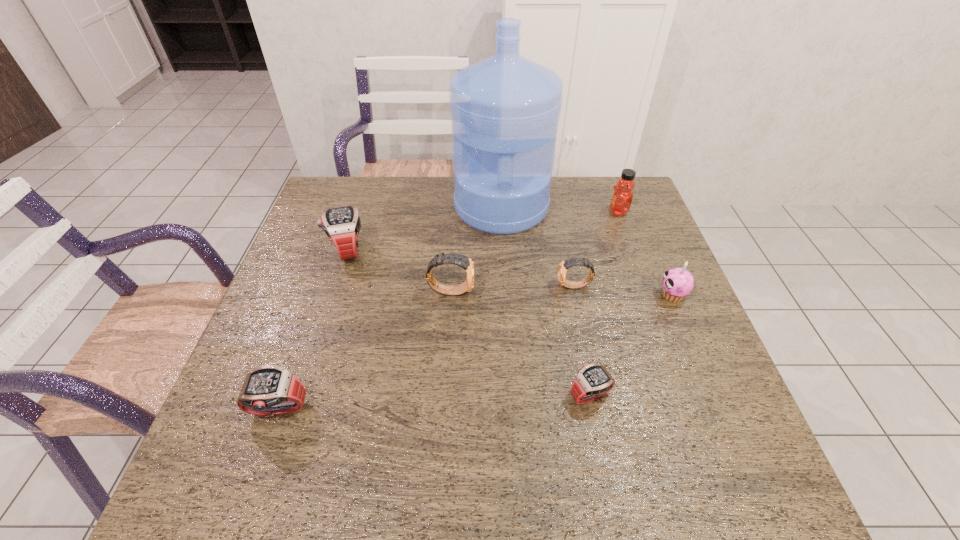
Select which red watch is the closest to the shortest object. Please provide its 2D coordinates. Your answer should be formatted as a tuple, i.e. [(x, y)], where the tuple contains the x and y coordinates of a point satisfying the conditions above.

[(270, 390)]

Choose which red watch is the second nearest neighbor to the honey. Please provide its 2D coordinates. Your answer should be formatted as a tuple, i.e. [(x, y)], where the tuple contains the x and y coordinates of a point satisfying the conditions above.

[(342, 225)]

The width and height of the screenshot is (960, 540). In order to click on blank space that satisfies the following two spatial constraints: 1. on the face of the smaller gold watch; 2. on the front side of the second biggest red watch in this screenshot , I will do `click(601, 410)`.